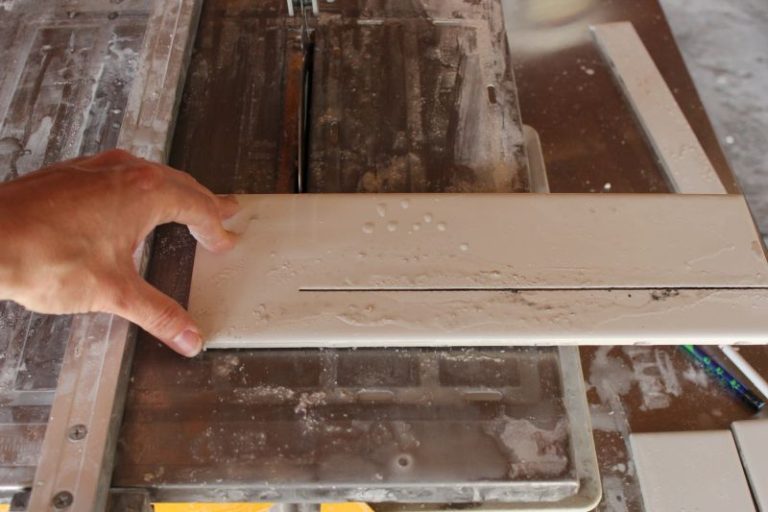
This screenshot has height=512, width=768. What are the coordinates of `wet tile` in the screenshot? It's located at (544, 455).